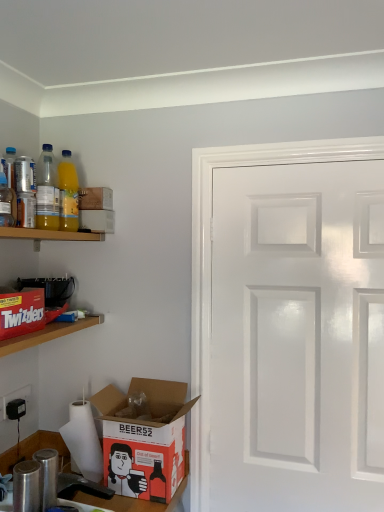
Question: Are black matte coffee maker at left, which is the second appliance in bottom-to-top order, and cardboard box at lower left, the 3th box in the top-to-bottom sequence, making contact?

Choices:
 (A) yes
 (B) no

Answer: (B)

Question: Does black matte coffee maker at left, which is the second appliance in bottom-to-top order, appear on the left side of cardboard box at lower left, the 1th box from the bottom?

Choices:
 (A) no
 (B) yes

Answer: (B)

Question: Is black matte coffee maker at left, which is the second appliance in bottom-to-top order, looking in the opposite direction of cardboard box at lower left, the 1th box from the bottom?

Choices:
 (A) no
 (B) yes

Answer: (A)

Question: Is black matte coffee maker at left, positioned as the second appliance in front-to-back order, not within cardboard box at lower left, the 1th box from the bottom?

Choices:
 (A) yes
 (B) no

Answer: (A)

Question: Is black matte coffee maker at left, the 1th appliance viewed from the back, smaller than cardboard box at lower left, the 1th box from the bottom?

Choices:
 (A) yes
 (B) no

Answer: (A)

Question: Is metallic can at upper left, the fourth bottle from the right, facing away from yellow translucent bottle at upper left, which appears as the 1th bottle when viewed from the back?

Choices:
 (A) yes
 (B) no

Answer: (B)

Question: Could yellow translucent bottle at upper left, the fourth bottle positioned from the front, be considered to be inside metallic can at upper left, acting as the third bottle starting from the back?

Choices:
 (A) yes
 (B) no

Answer: (B)

Question: Is metallic can at upper left, the fourth bottle from the right, to the left of yellow translucent bottle at upper left, which is the first bottle in right-to-left order, from the viewer's perspective?

Choices:
 (A) yes
 (B) no

Answer: (A)

Question: Is there a large distance between metallic can at upper left, the 2th bottle in the front-to-back sequence, and yellow translucent bottle at upper left, which is the first bottle in right-to-left order?

Choices:
 (A) no
 (B) yes

Answer: (A)

Question: Can we say metallic can at upper left, the fourth bottle from the right, lies outside yellow translucent bottle at upper left, which is the first bottle in right-to-left order?

Choices:
 (A) no
 (B) yes

Answer: (B)

Question: Does metallic can at upper left, the 2th bottle in the front-to-back sequence, come in front of yellow translucent bottle at upper left, which appears as the 4th bottle when viewed from the left?

Choices:
 (A) no
 (B) yes

Answer: (B)

Question: Are red cardboard twizzlers at left, the 1th shelf when ordered from bottom to top, and white glossy door at right beside each other?

Choices:
 (A) no
 (B) yes

Answer: (A)